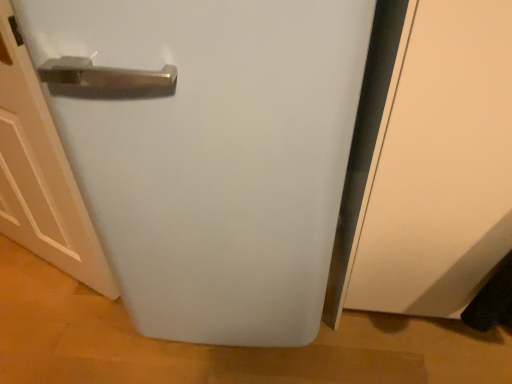
Question: From a real-world perspective, relative to white matte door at left, is white matte refrigerator at center vertically above or below?

Choices:
 (A) below
 (B) above

Answer: (B)

Question: Is point (131, 162) closer or farther from the camera than point (100, 248)?

Choices:
 (A) farther
 (B) closer

Answer: (B)

Question: From their relative heights in the image, would you say white matte refrigerator at center is taller or shorter than white matte door at left?

Choices:
 (A) short
 (B) tall

Answer: (B)

Question: Is white matte door at left taller or shorter than white matte refrigerator at center?

Choices:
 (A) tall
 (B) short

Answer: (B)

Question: In terms of size, does white matte door at left appear bigger or smaller than white matte refrigerator at center?

Choices:
 (A) big
 (B) small

Answer: (B)

Question: Relative to white matte refrigerator at center, is white matte door at left in front or behind?

Choices:
 (A) front
 (B) behind

Answer: (B)

Question: Is point (91, 221) closer or farther from the camera than point (317, 71)?

Choices:
 (A) farther
 (B) closer

Answer: (A)